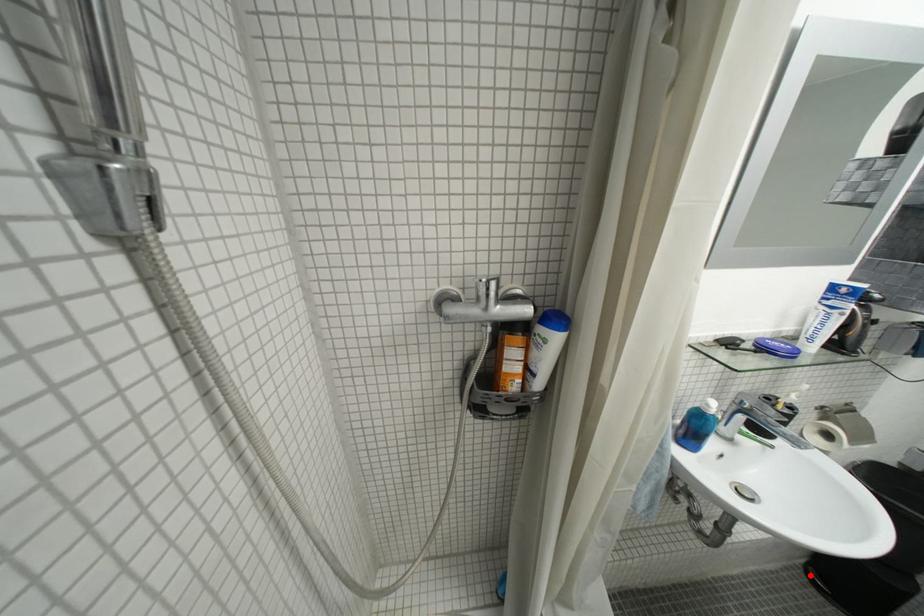
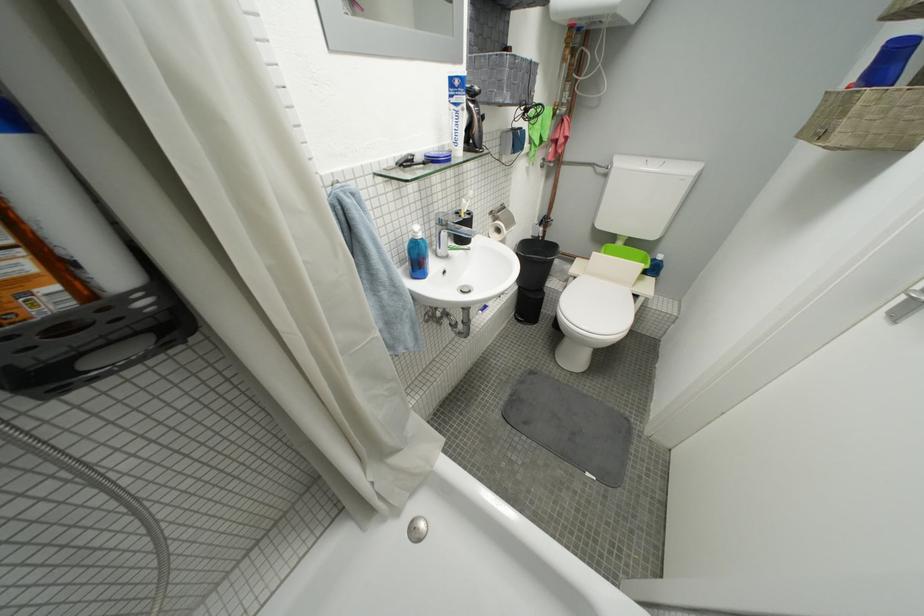
Question: A red point is marked in image1. In image2, is the corresponding 3D point closer to the camera or farther? Reply with the corresponding letter.

Choices:
 (A) The corresponding 3D point is closer.
 (B) The corresponding 3D point is farther.

Answer: (A)